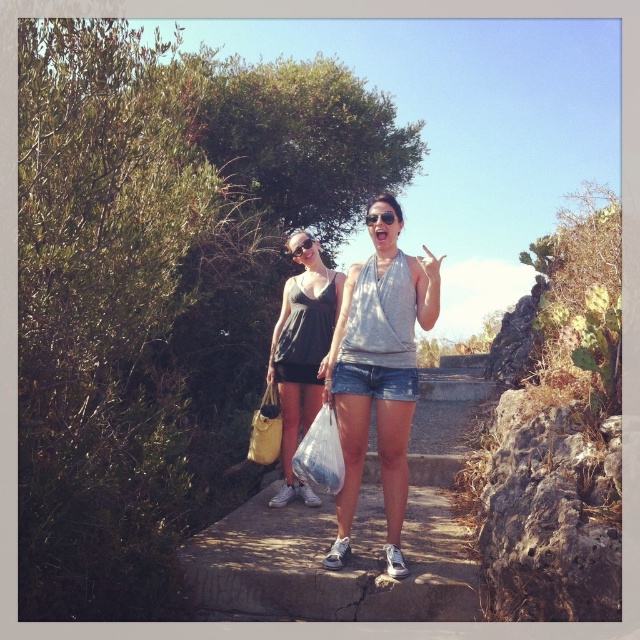
You are a photographer trying to capture a candid shot of the two people on the stone pathway. You want to ensure the matte yellow fabric bag at center is visible in the frame. Based on its position, where should you aim your camera relative to the two individuals?

The matte yellow fabric bag at center is located at coordinates (266, 429), which is to the right and slightly above the center of the image. To include it in the frame, aim your camera slightly to the right and upward relative to the two individuals standing on the pathway.

You are standing on the stone pathway and want to pick up the translucent plastic bag at center. Based on the coordinates provided, in which direction should you move relative to the two people to reach the bag?

The translucent plastic bag at center is located at coordinates point (321, 452). Since the bag is at the center, you should move towards the middle area between the two individuals to reach it.